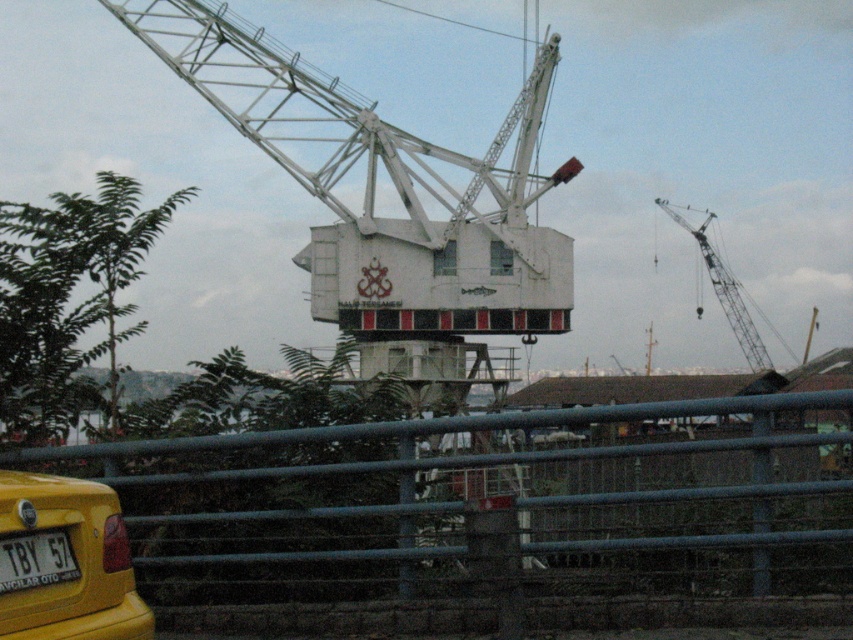
You are standing at the edge of a dock and see the metallic gray fence at lower center and the white metallic crane at upper right. Which object is closer to your left side?

The metallic gray fence at lower center is positioned on the left side of the white metallic crane at upper right, so it is closer to your left side.

You are standing at the point marked by coordinates (65, 561) in the image. What object is located exactly at this point?

The yellow matte taxi at lower left is located exactly at point (65, 561).

You are a delivery driver who needs to unload a package near the metallic gray fence at lower center. The white metallic crane at upper right is blocking your path. Can you estimate if there is enough space to maneuver around the crane and reach the fence?

The metallic gray fence at lower center might be wider than the white metallic crane at upper right, so there could be enough space to maneuver around the crane and reach the fence.